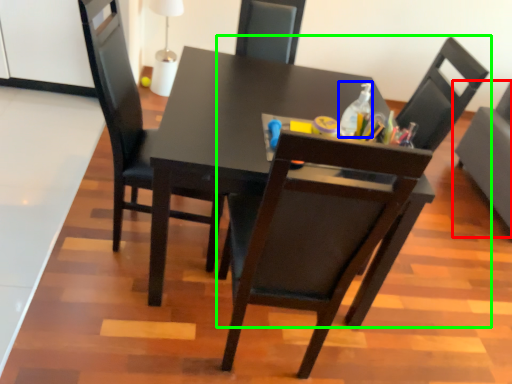
Question: Considering the real-world distances, which object is farthest from chair (highlighted by a red box)? bottle (highlighted by a blue box) or chair (highlighted by a green box)?

Choices:
 (A) bottle
 (B) chair

Answer: (A)